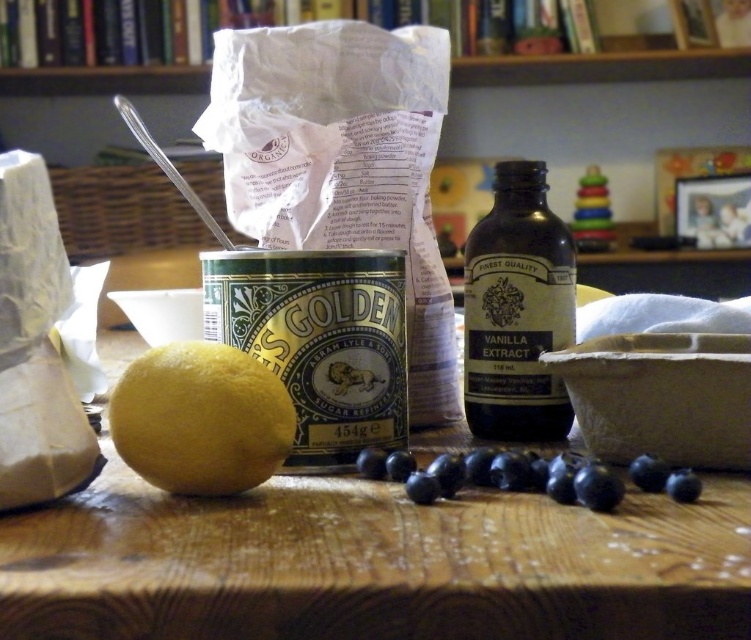
From the picture: Between wooden table at center and dark brown glass bottle at center, which one appears on the left side from the viewer's perspective?

wooden table at center

Does wooden table at center have a greater height compared to dark brown glass bottle at center?

No, wooden table at center is not taller than dark brown glass bottle at center.

Who is more distant from viewer, (442, 432) or (558, 224)?

The point (442, 432) is more distant.

This screenshot has height=640, width=751. Find the location of `wooden table at center`. wooden table at center is located at coordinates (372, 564).

Can you confirm if wooden table at center is shorter than blue matte blueberries at center?

In fact, wooden table at center may be taller than blue matte blueberries at center.

Identify the location of wooden table at center. (372, 564).

Locate an element on the screen. This screenshot has width=751, height=640. wooden table at center is located at coordinates (372, 564).

Does dark brown glass bottle at center appear on the right side of yellow matte lemon at center?

Yes, dark brown glass bottle at center is to the right of yellow matte lemon at center.

Is dark brown glass bottle at center positioned in front of yellow matte lemon at center?

No, dark brown glass bottle at center is further to the viewer.

Is point (487, 429) in front of point (155, 433)?

No.

The image size is (751, 640). In order to click on dark brown glass bottle at center in this screenshot , I will do `click(517, 310)`.